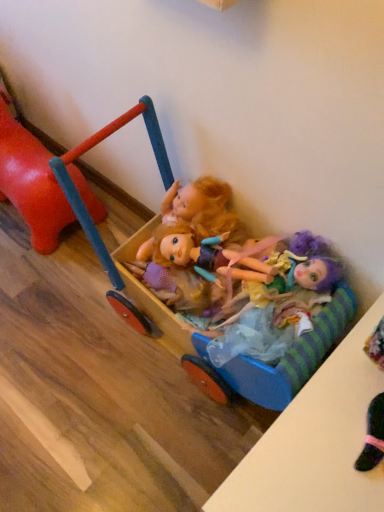
This screenshot has height=512, width=384. I want to click on blank space to the left of wooden cart at center, which is the first toy from right to left, so click(61, 355).